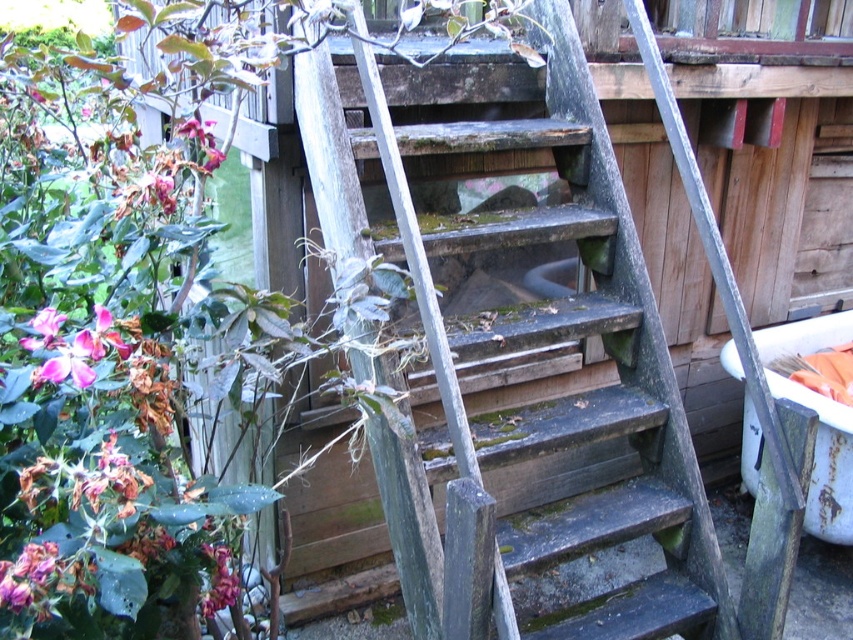
You are standing at the bottom of the wooden stairs leading to the deck and want to take a photo of both point [100,323] and point [215,604]. Since you want both points to be in focus, which point should you focus on to ensure the other is also sharp?

You should focus on point [100,323] because it is closer to the camera than point [215,604]. When focusing on the closer object, the depth of field will extend further back, increasing the likelihood that the farther point is also in acceptable focus.

You are a gardener who needs to place a new decorative item between the white plastic tub at right and the pink matte flower at left. Considering their widths, which object should you place closer to the center of the path to ensure the path remains accessible?

The white plastic tub at right is wider than the pink matte flower at left. To keep the path accessible, place the wider white plastic tub at right closer to its original position and move the narrower pink matte flower at left slightly toward the center, ensuring the path remains wide enough for passage.